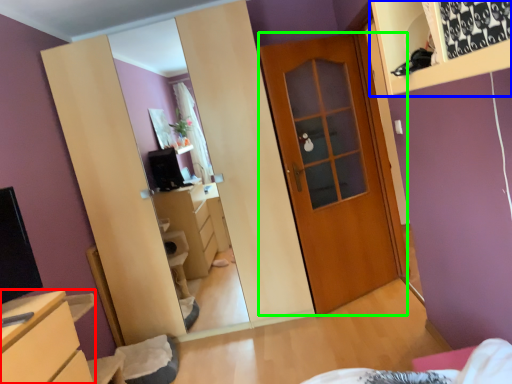
Question: Which object is positioned closest to chest of drawers (highlighted by a red box)? Select from shelf (highlighted by a blue box) and door (highlighted by a green box).

Choices:
 (A) shelf
 (B) door

Answer: (A)